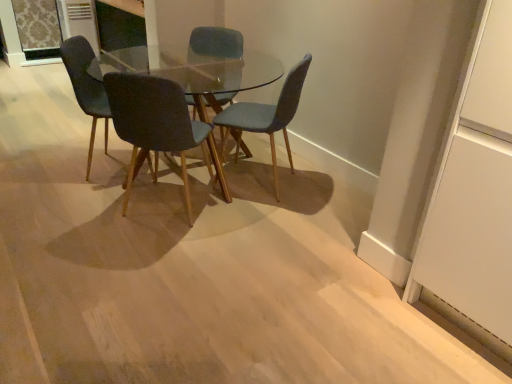
Locate an element on the screen. This screenshot has width=512, height=384. vacant point to the left of transparent glass door at upper right is located at coordinates (367, 312).